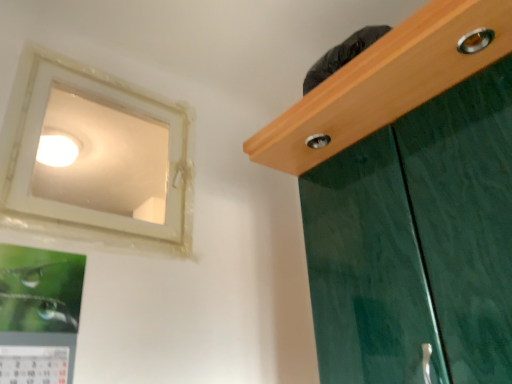
Question: Is white plastic window at upper left to the left or to the right of metallic silver picture frame at lower left in the image?

Choices:
 (A) right
 (B) left

Answer: (A)

Question: From their relative heights in the image, would you say white plastic window at upper left is taller or shorter than metallic silver picture frame at lower left?

Choices:
 (A) short
 (B) tall

Answer: (B)

Question: Based on their relative distances, which object is nearer to the white plastic window at upper left?

Choices:
 (A) metallic silver picture frame at lower left
 (B) white glossy light fixture at upper left

Answer: (B)

Question: Considering the real-world distances, which object is farthest from the metallic silver picture frame at lower left?

Choices:
 (A) white glossy light fixture at upper left
 (B) white plastic window at upper left

Answer: (A)